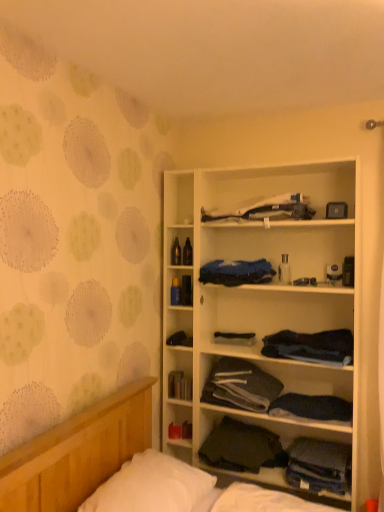
Question: Considering the positions of matte black book at center and white soft pillow at lower left in the image, is matte black book at center wider or thinner than white soft pillow at lower left?

Choices:
 (A) wide
 (B) thin

Answer: (B)

Question: In the image, is matte black book at center on the left side or the right side of white soft pillow at lower left?

Choices:
 (A) right
 (B) left

Answer: (A)

Question: Which is farther from the black fabric at center, the 4th clothing in the top-to-bottom sequence?

Choices:
 (A) matte black book at center
 (B) white fabric bag at upper center, the 1th clothing positioned from the top
 (C) dark blue fabric at center, which is the second clothing in top-to-bottom order
 (D) dark gray fabric at center, the 4th clothing in the bottom-to-top sequence
 (E) dark gray fabric at center, the seventh clothing viewed from the top

Answer: (B)

Question: Which object is the farthest from the white wood cabinet at center?

Choices:
 (A) dark gray fabric at center, the eighth clothing when ordered from top to bottom
 (B) black fabric at center, the 4th clothing in the top-to-bottom sequence
 (C) matte black book at center
 (D) dark blue fabric at center, the 6th clothing ordered from the bottom
 (E) dark blue fabric at center, which ranks as the third clothing in bottom-to-top order

Answer: (C)